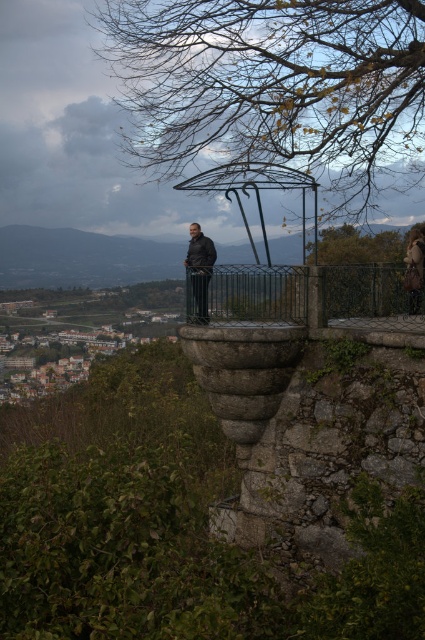
You are standing on the stone balcony and want to take a photo of the brown leather jacket at right without the brown leafy branches at upper center blocking the view. How should you position yourself?

Move to the left side of the stone balcony so that the brown leafy branches at upper center are out of frame, allowing an unobstructed view of the brown leather jacket at right.

You are a tour guide explaining the historical site to visitors. You point to the green wrought iron fence at center and the brown leather jacket at right. Which object would you describe as being bigger in size?

The green wrought iron fence at center has a larger size compared to the brown leather jacket at right, so the green wrought iron fence at center is bigger.